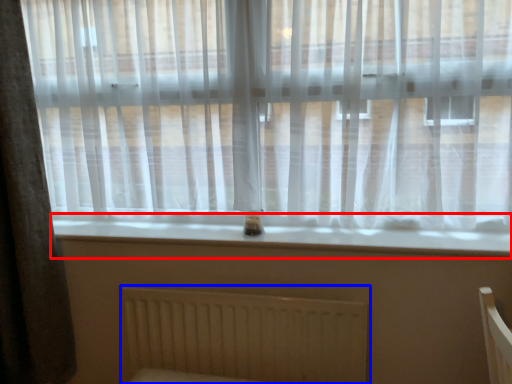
Question: Which of the following is the farthest to the observer, window sill (highlighted by a red box) or radiator (highlighted by a blue box)?

Choices:
 (A) window sill
 (B) radiator

Answer: (B)